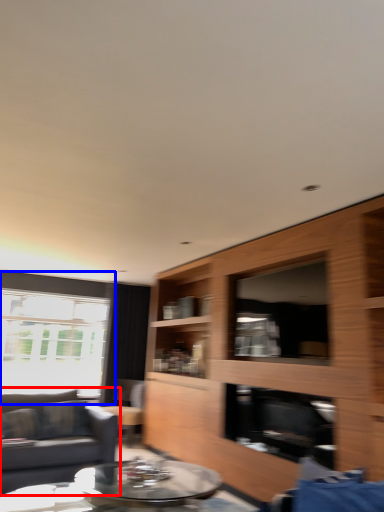
Question: Which of the following is the closest to the observer, studio couch (highlighted by a red box) or window (highlighted by a blue box)?

Choices:
 (A) studio couch
 (B) window

Answer: (A)